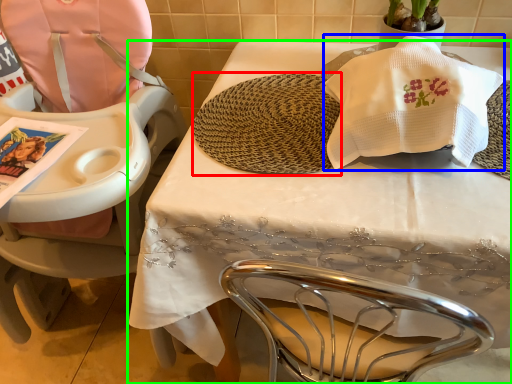
Question: Based on their relative distances, which object is nearer to mat (highlighted by a red box)? Choose from blanket (highlighted by a blue box) and table (highlighted by a green box).

Choices:
 (A) blanket
 (B) table

Answer: (B)